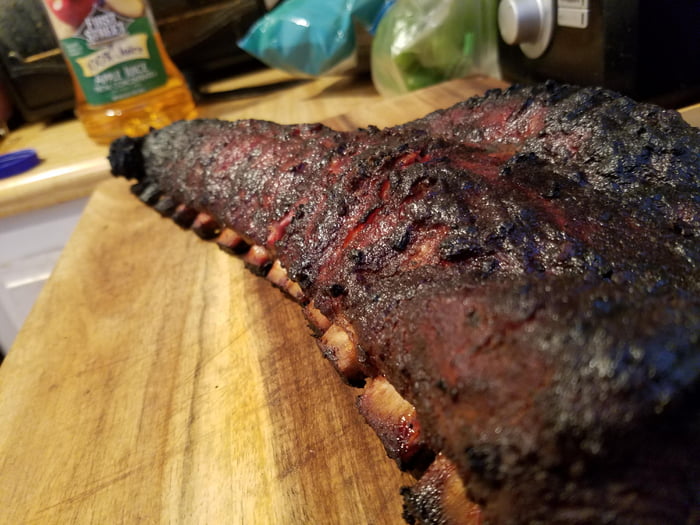
Where is `microwave`? microwave is located at coordinates (592, 50).